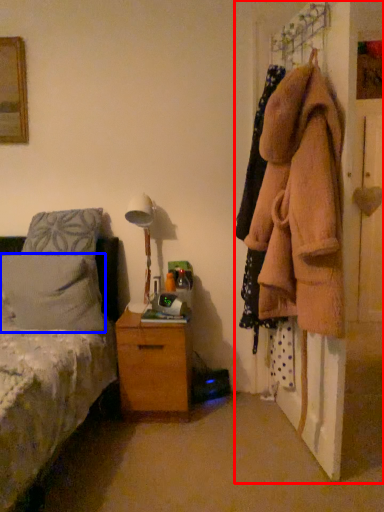
Question: Which of the following is the farthest to the observer, closet (highlighted by a red box) or pillow (highlighted by a blue box)?

Choices:
 (A) closet
 (B) pillow

Answer: (B)